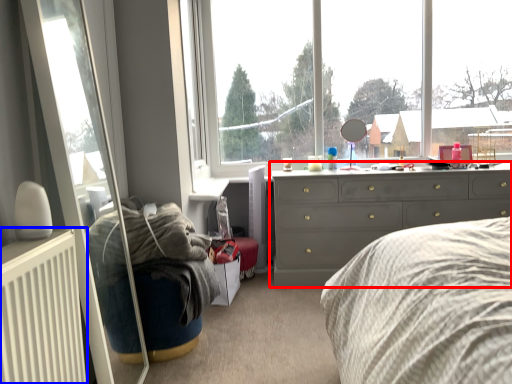
Question: Which of the following is the closest to the observer, chest of drawers (highlighted by a red box) or radiator (highlighted by a blue box)?

Choices:
 (A) chest of drawers
 (B) radiator

Answer: (B)